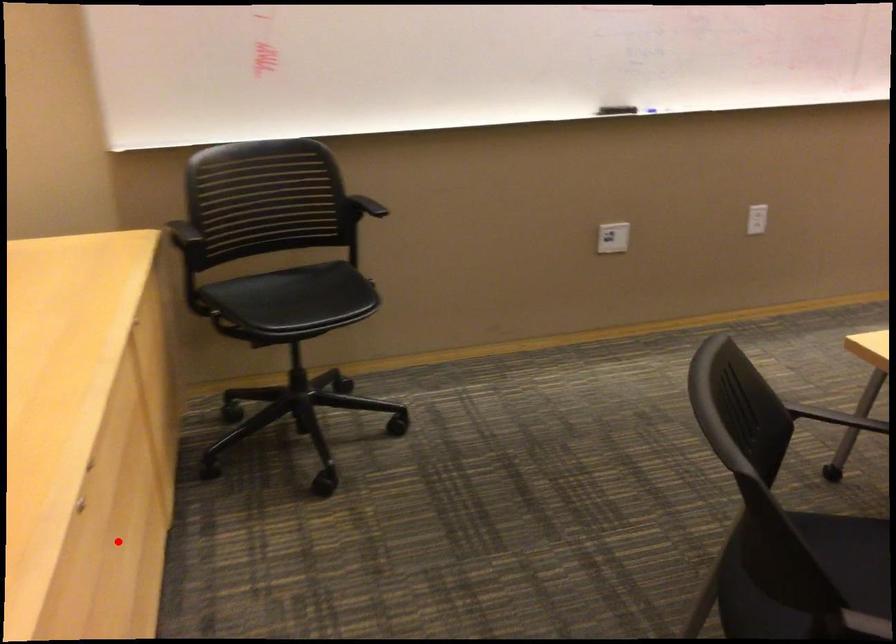
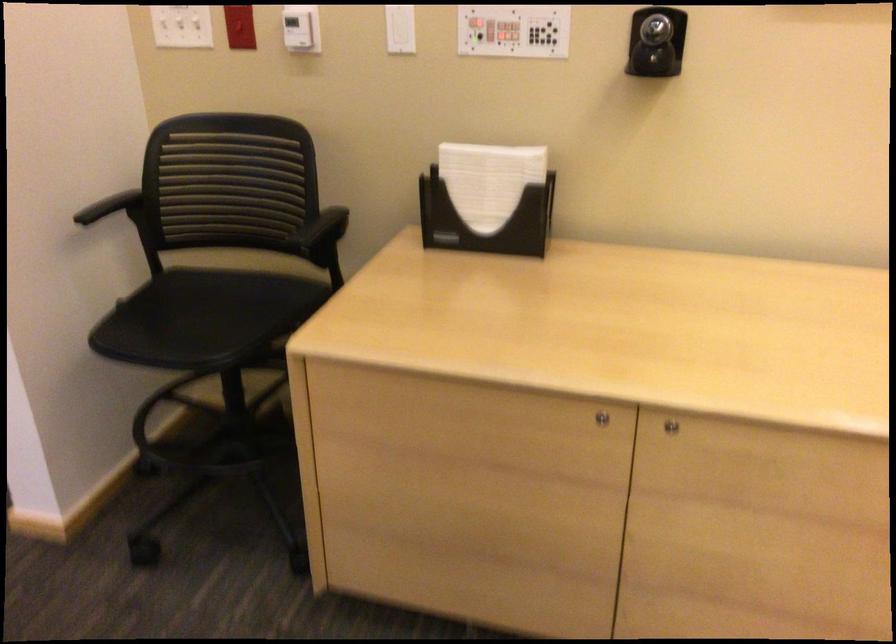
Question: I am providing you with two images of the same scene from different viewpoints. Image1 has a red point marked. In image2, the corresponding 3D location appears at what relative position? Reply with the corresponding letter.

Choices:
 (A) Closer
 (B) Farther

Answer: (B)